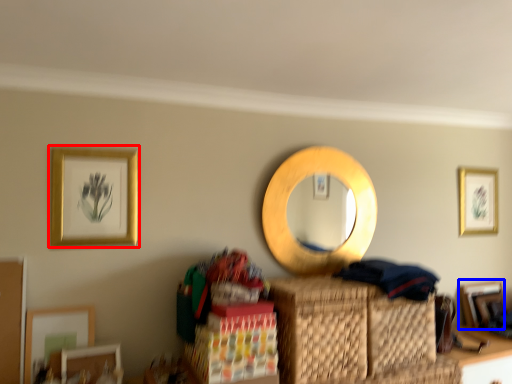
Question: Which of the following is the farthest to the observer, picture frame (highlighted by a red box) or picture frame (highlighted by a blue box)?

Choices:
 (A) picture frame
 (B) picture frame

Answer: (B)